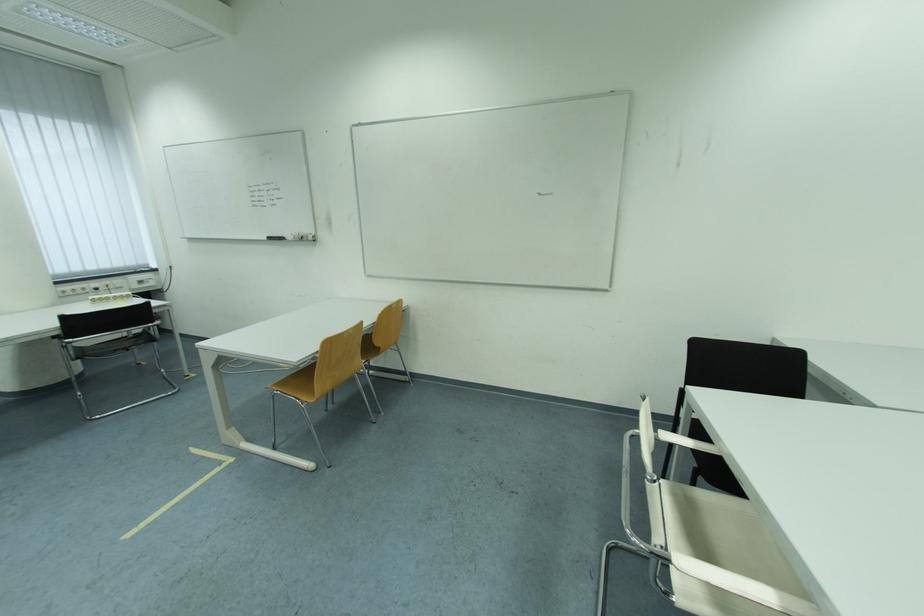
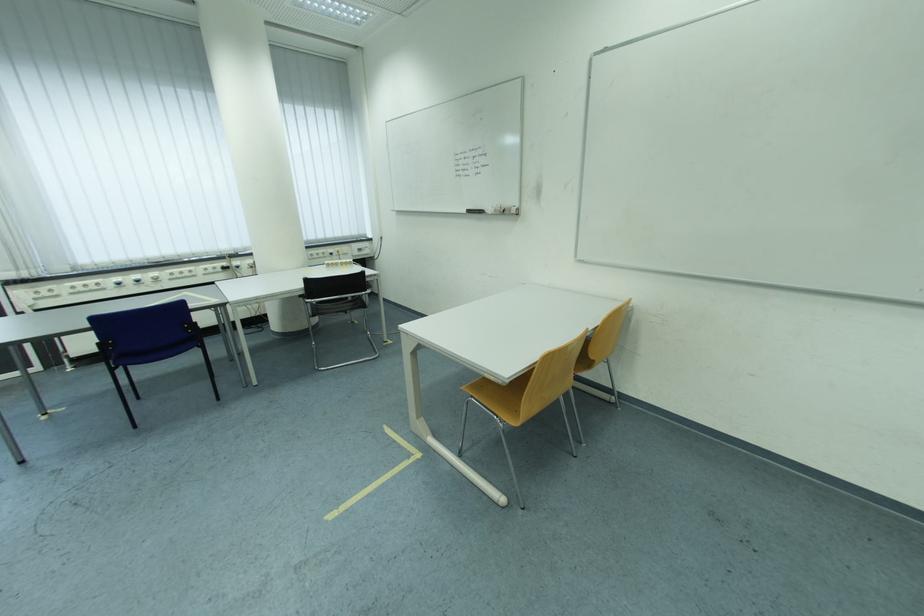
In a continuous first-person perspective shot, in which direction is the camera moving?

The movement direction of the cameraman is left, forward.